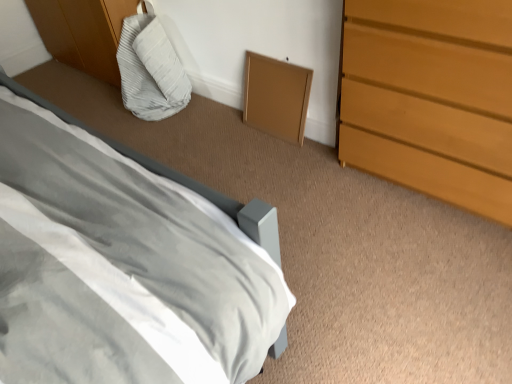
Question: From the image's perspective, is light brown wooden chest of drawers at right beneath matte gray bed at lower left?

Choices:
 (A) yes
 (B) no

Answer: (B)

Question: Could you tell me if light brown wooden chest of drawers at right is turned towards matte gray bed at lower left?

Choices:
 (A) yes
 (B) no

Answer: (A)

Question: From the image's perspective, is light brown wooden chest of drawers at right on top of matte gray bed at lower left?

Choices:
 (A) yes
 (B) no

Answer: (A)

Question: Is light brown wooden chest of drawers at right closer to camera compared to matte gray bed at lower left?

Choices:
 (A) no
 (B) yes

Answer: (A)

Question: Is the position of light brown wooden chest of drawers at right more distant than that of matte gray bed at lower left?

Choices:
 (A) yes
 (B) no

Answer: (A)

Question: Is matte gray bed at lower left inside or outside of light gray fabric bean bag at upper left?

Choices:
 (A) inside
 (B) outside

Answer: (B)

Question: From the image's perspective, is matte gray bed at lower left above or below light gray fabric bean bag at upper left?

Choices:
 (A) below
 (B) above

Answer: (A)

Question: Looking at the image, does matte gray bed at lower left seem bigger or smaller compared to light gray fabric bean bag at upper left?

Choices:
 (A) big
 (B) small

Answer: (A)

Question: In the image, is matte gray bed at lower left on the left side or the right side of light gray fabric bean bag at upper left?

Choices:
 (A) right
 (B) left

Answer: (A)

Question: From a real-world perspective, is light brown wooden chest of drawers at right positioned above or below matte gray bed at lower left?

Choices:
 (A) above
 (B) below

Answer: (B)

Question: In terms of size, does light brown wooden chest of drawers at right appear bigger or smaller than matte gray bed at lower left?

Choices:
 (A) big
 (B) small

Answer: (B)

Question: Is light brown wooden chest of drawers at right wider or thinner than matte gray bed at lower left?

Choices:
 (A) wide
 (B) thin

Answer: (A)

Question: Would you say light brown wooden chest of drawers at right is inside or outside matte gray bed at lower left?

Choices:
 (A) inside
 (B) outside

Answer: (B)

Question: From the image's perspective, is light gray fabric bean bag at upper left positioned above or below light brown wooden chest of drawers at right?

Choices:
 (A) below
 (B) above

Answer: (B)

Question: Is light gray fabric bean bag at upper left to the left or to the right of light brown wooden chest of drawers at right in the image?

Choices:
 (A) left
 (B) right

Answer: (A)